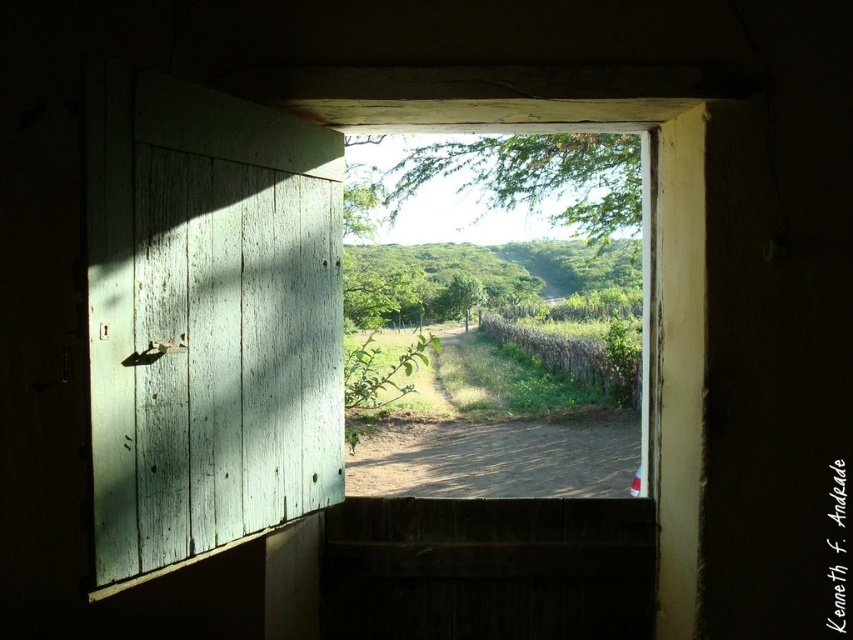
Question: Which of the following is the closest to the observer?

Choices:
 (A) green leafy tree at center
 (B) green wooden fence at center
 (C) green painted wood door at left

Answer: (C)

Question: Considering the relative positions of green wooden fence at center and green leafy tree at center in the image provided, where is green wooden fence at center located with respect to green leafy tree at center?

Choices:
 (A) above
 (B) below

Answer: (A)

Question: Does green painted wood door at left lie behind green wooden fence at center?

Choices:
 (A) no
 (B) yes

Answer: (A)

Question: Considering the real-world distances, which object is farthest from the green leafy tree at center?

Choices:
 (A) green wooden fence at center
 (B) green painted wood door at left

Answer: (B)

Question: Which point is farther to the camera?

Choices:
 (A) green leafy tree at center
 (B) green painted wood door at left
 (C) green wooden fence at center

Answer: (A)

Question: Does green painted wood door at left have a greater width compared to green wooden fence at center?

Choices:
 (A) yes
 (B) no

Answer: (B)